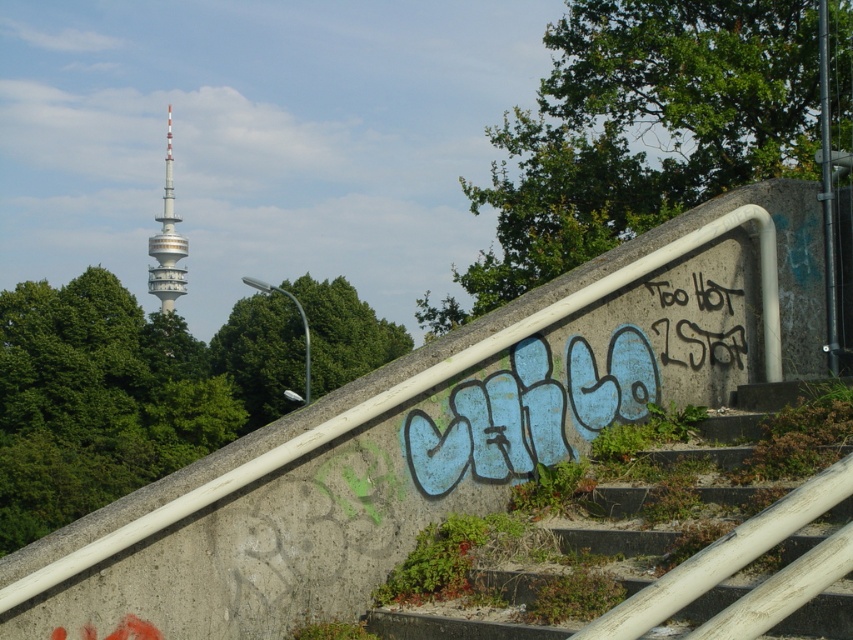
Question: Which point is farther to the camera?

Choices:
 (A) (460, 596)
 (B) (167, 131)
 (C) (708, 300)

Answer: (B)

Question: Is concrete stairs at center below black graffiti at upper right?

Choices:
 (A) no
 (B) yes

Answer: (B)

Question: Which point is farther to the camera?

Choices:
 (A) black graffiti at upper right
 (B) concrete stairs at center
 (C) white concrete tower at upper left

Answer: (C)

Question: Can you confirm if concrete stairs at center is positioned to the right of black graffiti at upper right?

Choices:
 (A) no
 (B) yes

Answer: (A)

Question: Considering the real-world distances, which object is closest to the black graffiti at upper right?

Choices:
 (A) white concrete tower at upper left
 (B) concrete stairs at center

Answer: (B)

Question: Is concrete stairs at center positioned in front of black graffiti at upper right?

Choices:
 (A) yes
 (B) no

Answer: (A)